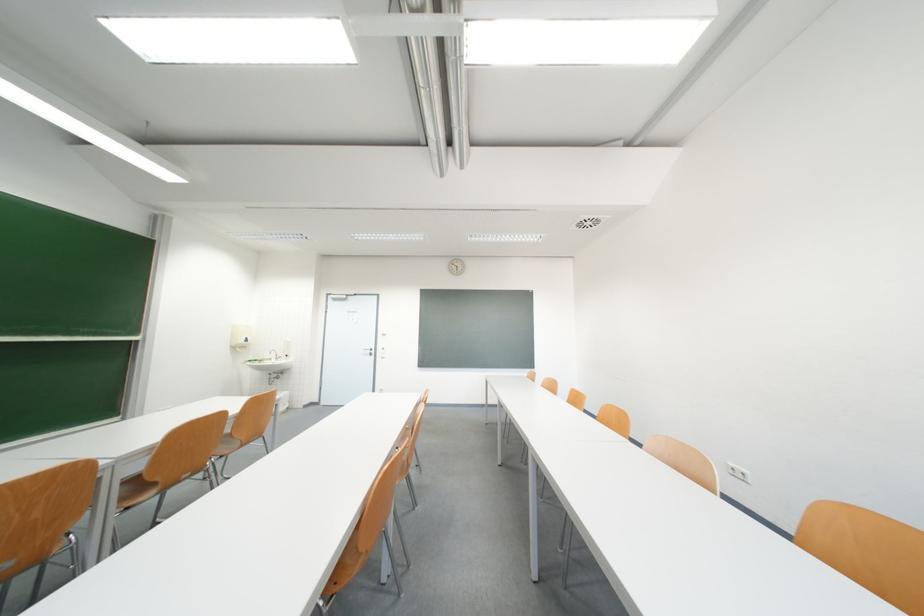
What do you see at coordinates (368, 351) in the screenshot? The height and width of the screenshot is (616, 924). I see `the door handle` at bounding box center [368, 351].